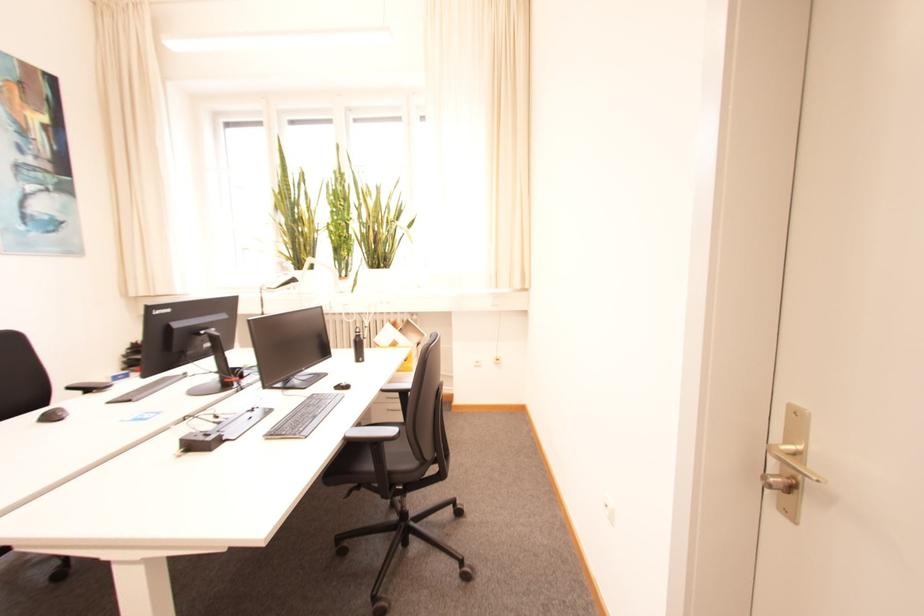
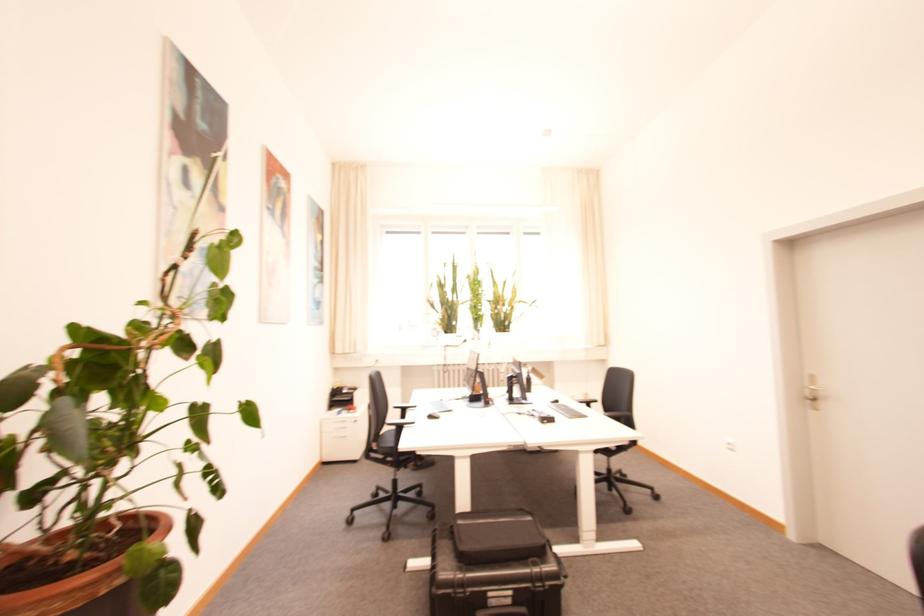
In a continuous first-person perspective shot, in which direction is the camera moving?

The movement direction of the cameraman is left, backward.